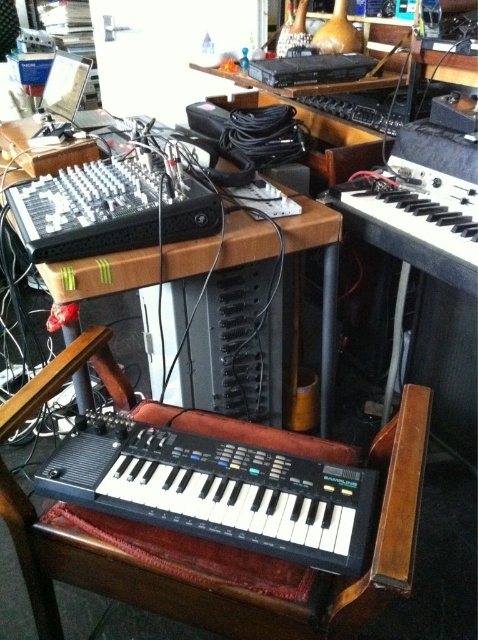
You are a technician in a recording studio. You need to adjust two points in the studio setup. The first point is at position point [44,264], and the second is at point [384,202]. Which point is closer to your current position?

Point [44,264] is closer to the camera than point [384,202], so the first point is closer to your current position.

You are setting up a music production studio and need to place a large amplifier next to the wooden table at center and the black plastic keyboard at right. Given that the amplifier is wider than both objects combined, will it fit between them if there is 1 meter of space between them?

The wooden table at center is larger than the black plastic keyboard at right. However, the total width of both objects combined plus the 1 meter space between them must be considered. Since the amplifier is wider than both combined, it will not fit in the available space.

You are a sound engineer setting up equipment in a recording studio. You need to place a microphone stand exactly 30 inches away from the black plastic keyboard at lower center. Can you position it behind the keyboard without moving it? Explain your reasoning.

The black plastic keyboard at lower center is 27.57 inches away from the camera. Since the microphone stand needs to be placed 30 inches away from the keyboard, positioning it behind would require a total distance of 27.57 inches plus the additional space behind. However, without knowing the total available space behind, we can only confirm the keyboard is within the required proximity range. The exact placement depends on the studio layout beyond the current setup.